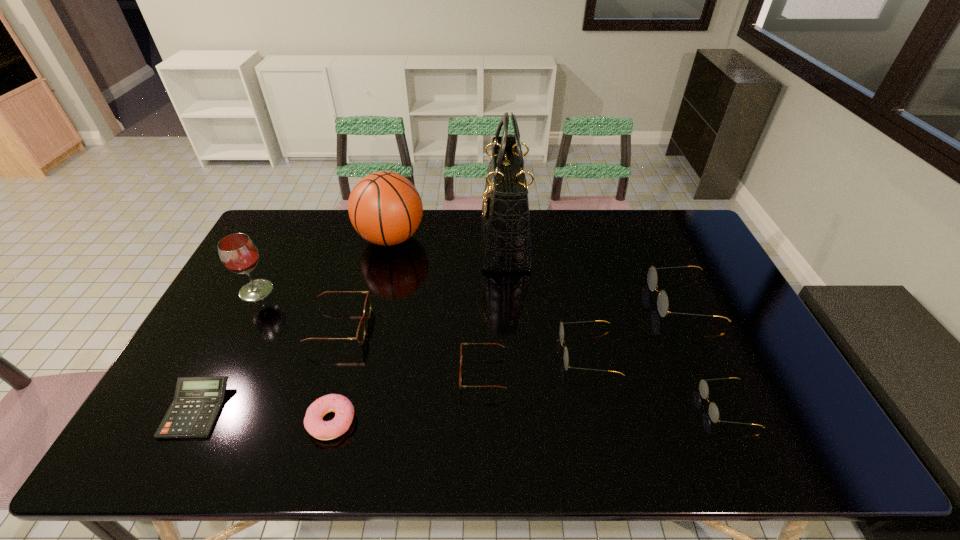
Locate an element on the screen. The image size is (960, 540). wineglass that is at the left edge is located at coordinates (238, 253).

Locate an element on the screen. The width and height of the screenshot is (960, 540). calculator located at the left edge is located at coordinates (197, 402).

Locate an element on the screen. object that is at the near left corner is located at coordinates (197, 402).

What are the coordinates of `object at the near right corner` in the screenshot? It's located at (703, 386).

The height and width of the screenshot is (540, 960). In the image, there is a desktop. In order to click on vacant area at the far edge in this screenshot , I will do pos(414,235).

The image size is (960, 540). In the image, there is a desktop. Identify the location of free space at the near edge. (424, 447).

Where is `free space at the left edge of the desktop`? The width and height of the screenshot is (960, 540). free space at the left edge of the desktop is located at coordinates click(221, 366).

Where is `vacant space at the far left corner of the desktop`? Image resolution: width=960 pixels, height=540 pixels. vacant space at the far left corner of the desktop is located at coordinates pyautogui.click(x=269, y=246).

This screenshot has height=540, width=960. In the image, there is a desktop. Identify the location of free region at the near left corner. (182, 458).

The height and width of the screenshot is (540, 960). What are the coordinates of `vacant space at the far right corner of the desktop` in the screenshot? It's located at (662, 213).